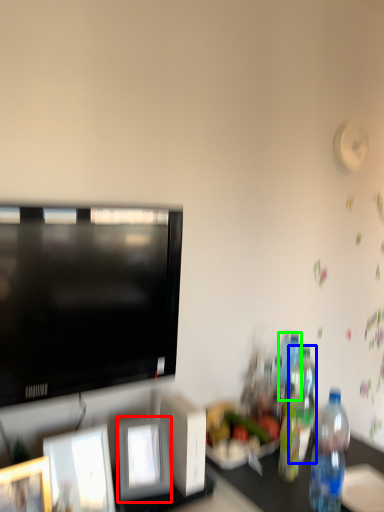
Question: Considering the real-world distances, which object is farthest from picture frame (highlighted by a red box)? bottle (highlighted by a blue box) or bottle (highlighted by a green box)?

Choices:
 (A) bottle
 (B) bottle

Answer: (B)